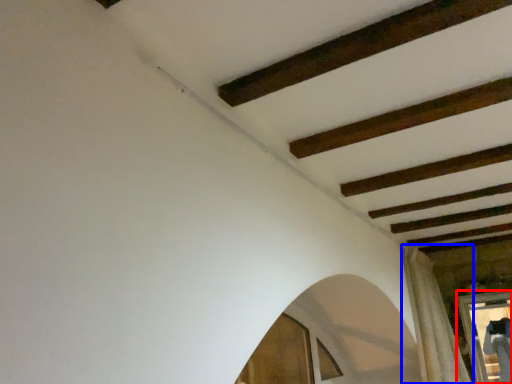
Question: Which object is closer to the camera taking this photo, window frame (highlighted by a red box) or curtain (highlighted by a blue box)?

Choices:
 (A) window frame
 (B) curtain

Answer: (B)